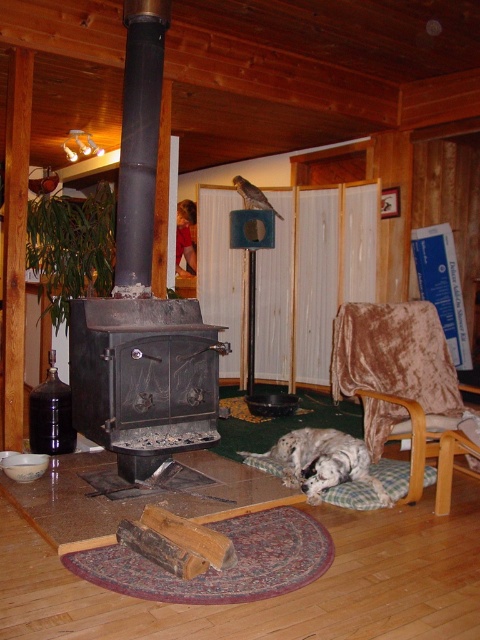
You are sitting in the velvet brown rocking chair at lower right and want to pet the white fluffy dog at lower center. Can you reach the dog without moving from the chair?

The velvet brown rocking chair at lower right is positioned on the right side of the white fluffy dog at lower center, so you are to the right of the dog. Since the dog is at lower center and you are at lower right, you can likely reach the dog by leaning forward or extending your arm towards the center of the room.

You are a person standing in the cabin and want to toss a stick to the white fluffy dog at lower center. The stick is 12 inches long. If you aim to throw it from the black matte fireplace at left, will the stick reach the dog?

The black matte fireplace at left is 30.65 inches away from the white fluffy dog at lower center. Since the stick is only 12 inches long, it won t reach the dog from that distance.